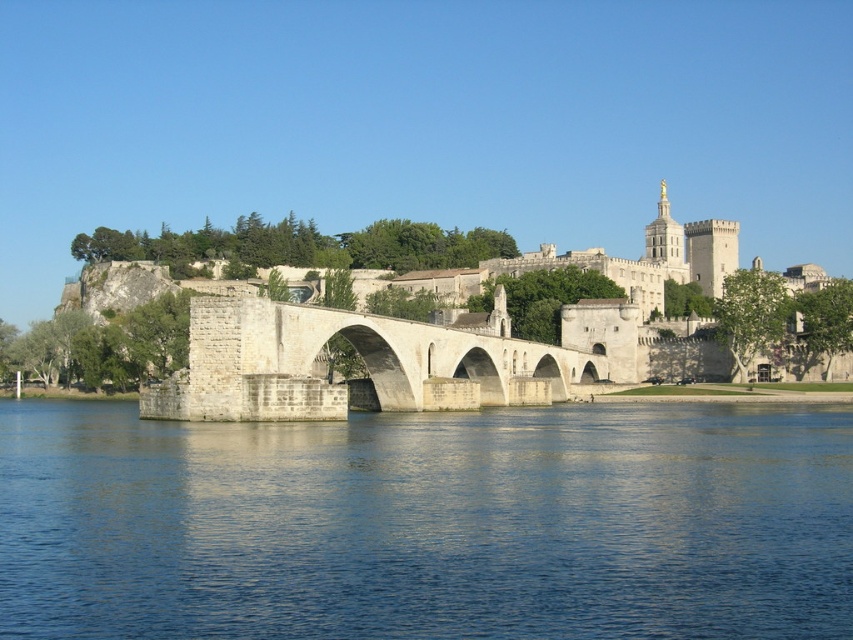
You are an architect analyzing the composition of this historic scene. Based on the image, which object takes up more visual space in the scene between the blue water at center and the white stone bridge at center?

The white stone bridge at center occupies more visual space than the blue water at center according to the description.

You are a tourist standing on the historic stone bridge and want to take a photo of the white stone castle at center and the blue water at center. Which object should you point your camera downward to capture?

You should point your camera downward to capture the blue water at center because it is located below the white stone castle at center.

You are a tourist visiting the historic site. You want to take a photo that includes both the white stone castle at center and the white stone bridge at center. Which object should you position closer to the camera to ensure both are fully visible in the frame?

Since the white stone castle at center is much taller than the white stone bridge at center, you should position the white stone bridge at center closer to the camera to ensure both are fully visible in the frame.